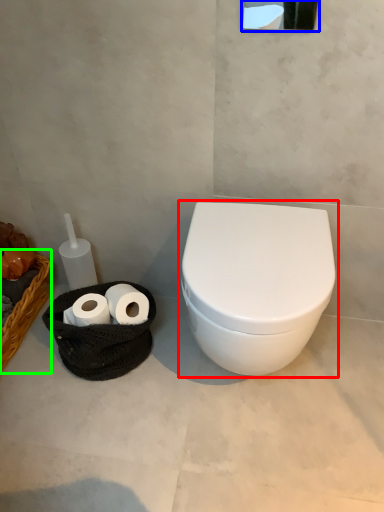
Question: Estimate the real-world distances between objects in this image. Which object is closer to toilet (highlighted by a red box), mirror (highlighted by a blue box) or basket (highlighted by a green box)?

Choices:
 (A) mirror
 (B) basket

Answer: (A)